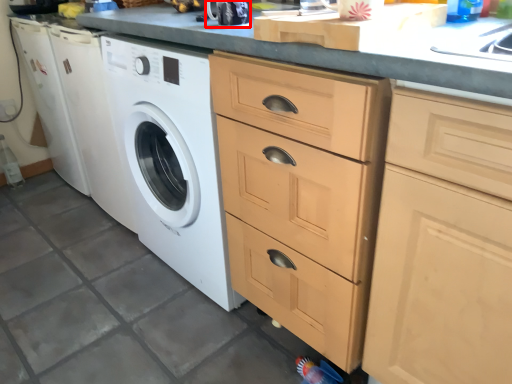
Question: Considering the relative positions of appliance (annotated by the red box) and cabinetry in the image provided, where is appliance (annotated by the red box) located with respect to the staircase?

Choices:
 (A) right
 (B) left

Answer: (B)